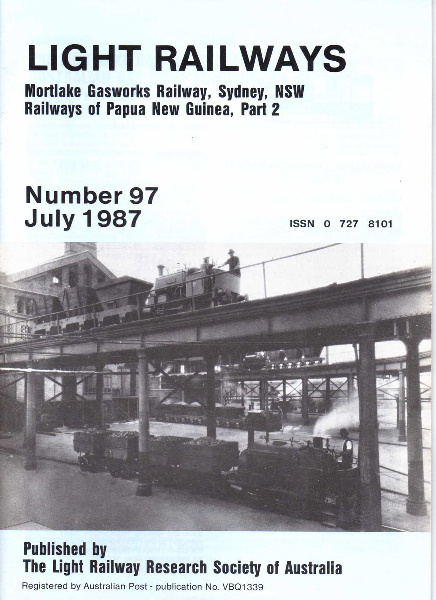
I want to click on support pillars, so click(x=141, y=427), click(x=29, y=408), click(x=373, y=414), click(x=415, y=398), click(x=401, y=400), click(x=349, y=388), click(x=304, y=392).